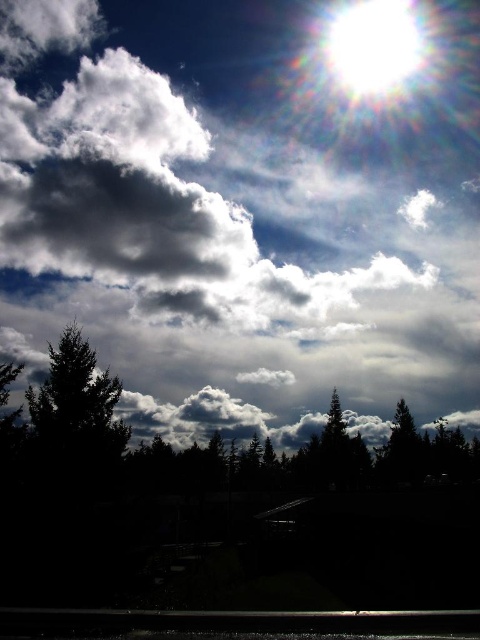
Question: Can you confirm if white glossy sun at upper center is positioned above green matte tree at lower right?

Choices:
 (A) yes
 (B) no

Answer: (A)

Question: Does dark green textured tree at left appear under green matte tree at lower right?

Choices:
 (A) yes
 (B) no

Answer: (B)

Question: Which of the following is the farthest from the observer?

Choices:
 (A) white glossy sun at upper center
 (B) green matte tree at lower right

Answer: (A)

Question: Does dark green textured tree at left have a larger size compared to white glossy sun at upper center?

Choices:
 (A) yes
 (B) no

Answer: (B)

Question: Which of the following is the farthest from the observer?

Choices:
 (A) (70, 426)
 (B) (377, 10)

Answer: (B)

Question: Which of the following is the farthest from the observer?

Choices:
 (A) white glossy sun at upper center
 (B) dark green textured tree at left
 (C) green matte tree at lower right

Answer: (A)